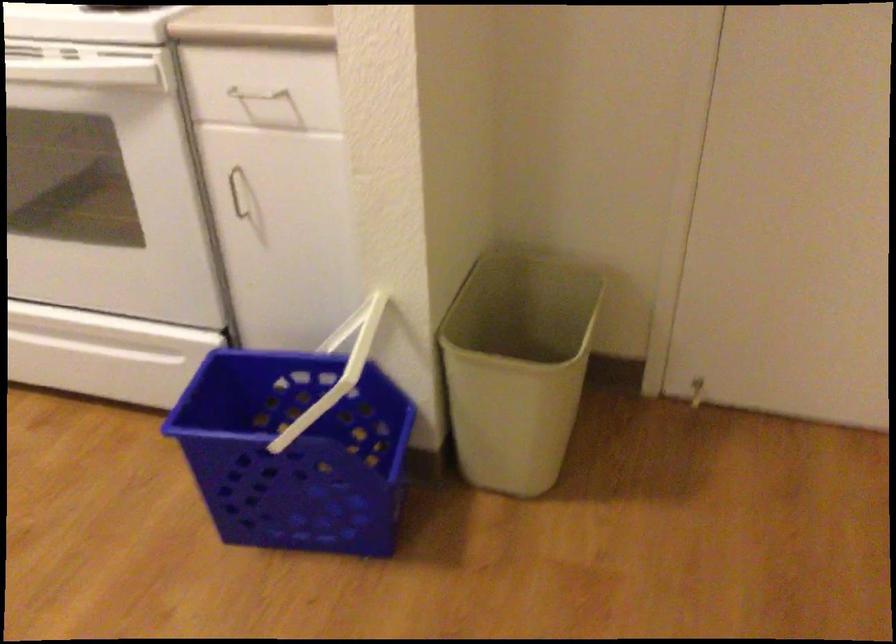
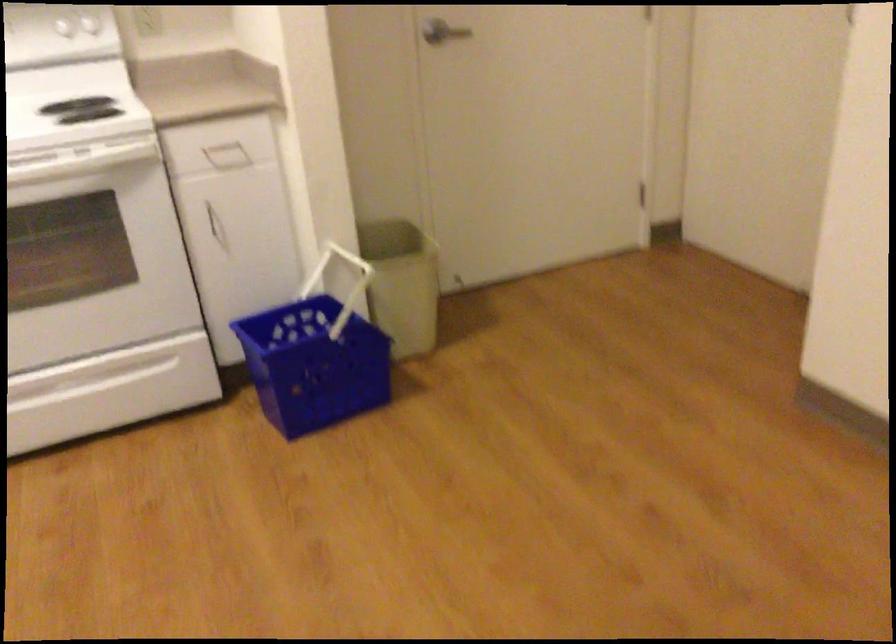
In the second image, find the point that corresponds to (x=393, y=339) in the first image.

(337, 272)